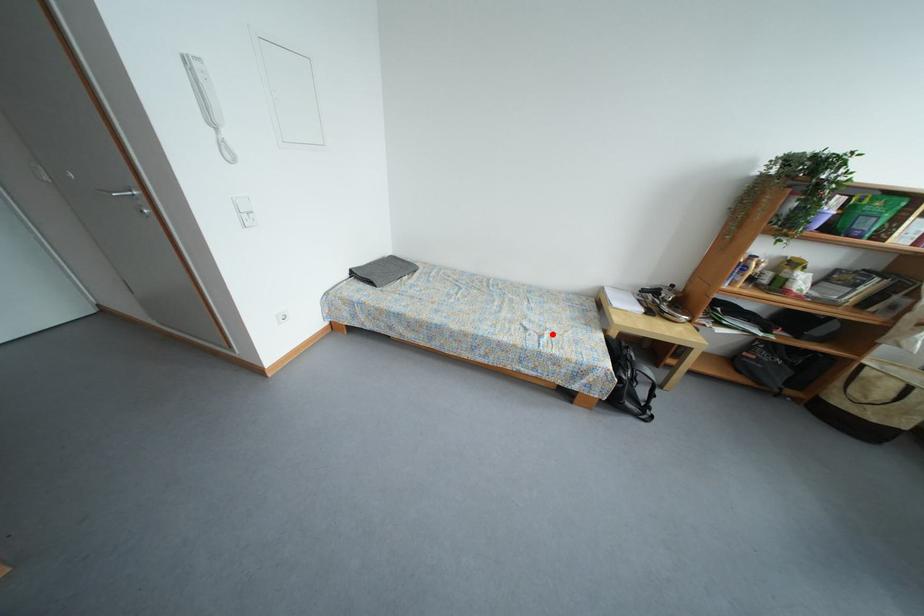
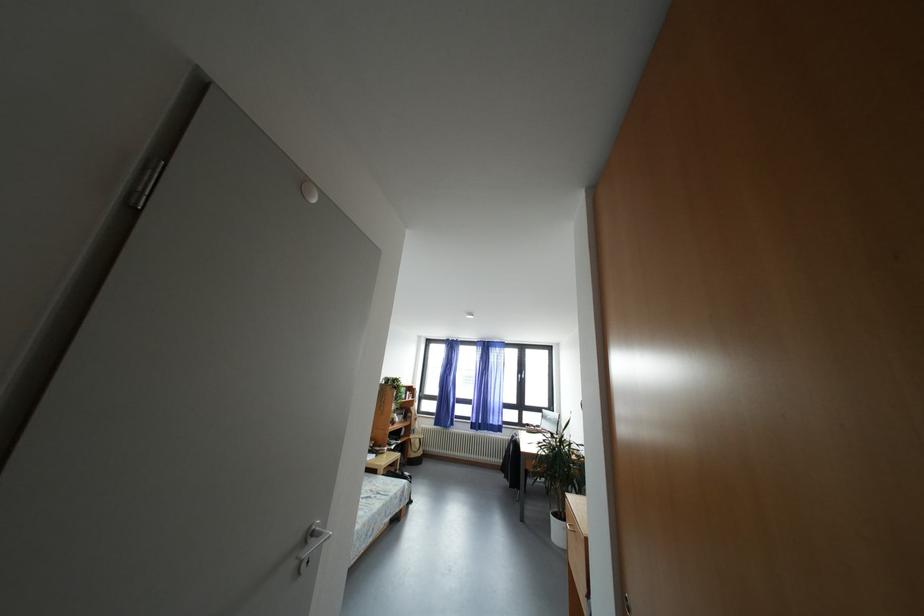
Question: I am providing you with two images of the same scene from different viewpoints. In image1, a red point is highlighted. Considering the same 3D point in image2, which of the following is correct?

Choices:
 (A) It is closer
 (B) It is farther

Answer: (A)